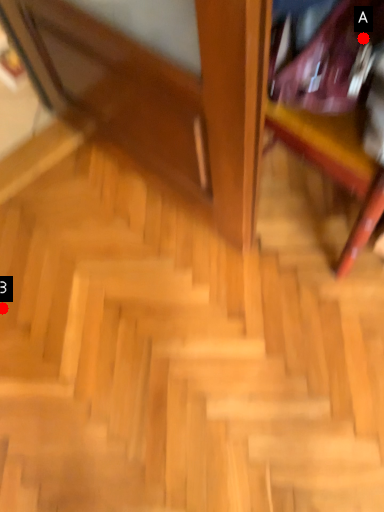
Question: Two points are circled on the image, labeled by A and B beside each circle. Which point is farther to the camera?

Choices:
 (A) A is further
 (B) B is further

Answer: (B)